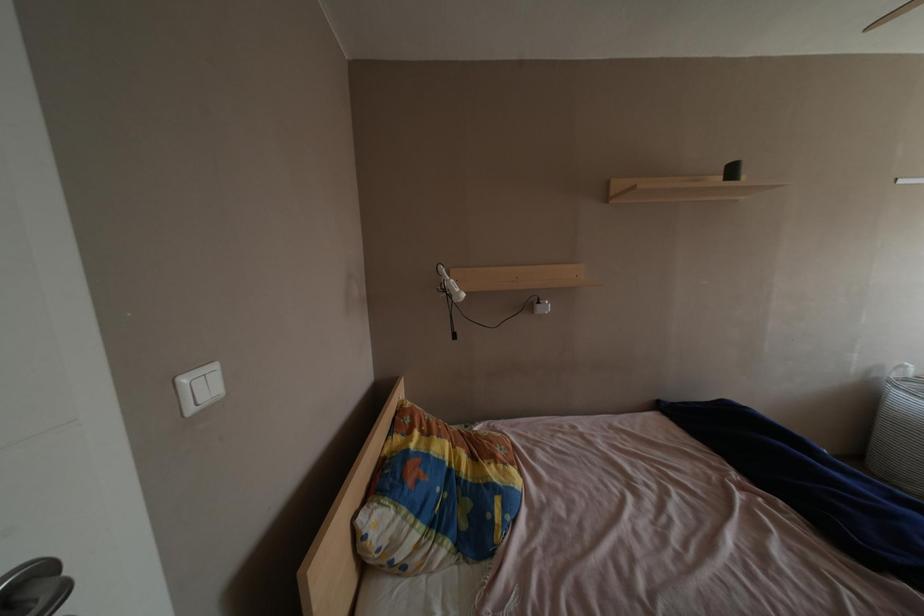
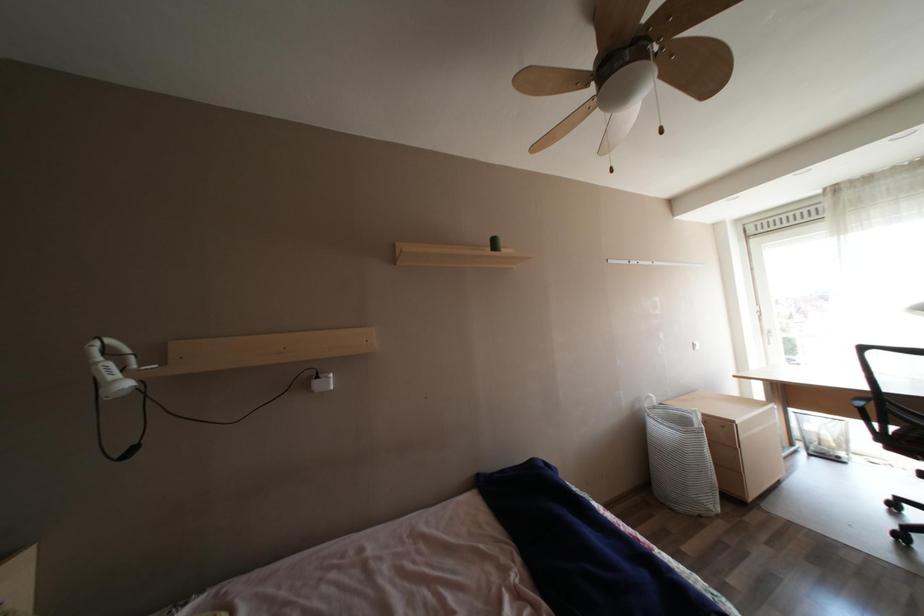
Question: The camera is either moving clockwise (left) or counter-clockwise (right) around the object. The first image is from the beginning of the video and the second image is from the end. Is the camera moving left or right when shooting the video?

Choices:
 (A) Left
 (B) Right

Answer: (A)